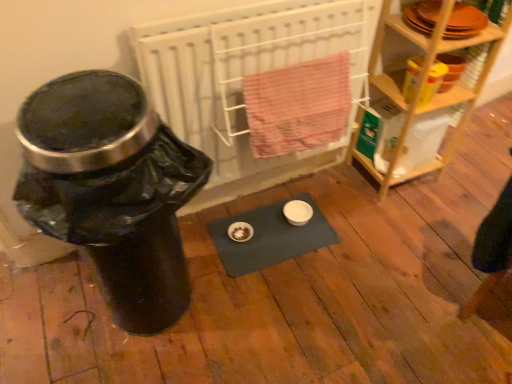
At what (x,y) coordinates should I click in order to perform the action: click on vacant space to the right of black plastic water cooler at left. Please return your answer as a coordinate pair (x, y). This screenshot has width=512, height=384. Looking at the image, I should click on (251, 299).